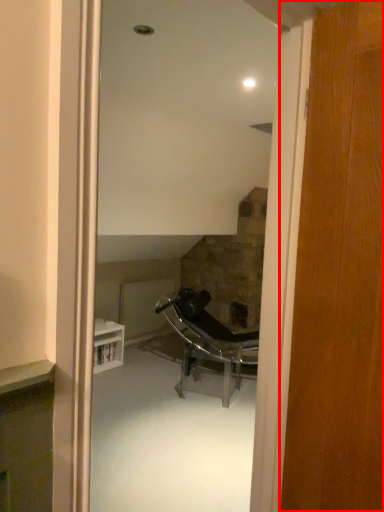
Question: From the image, what is the correct spatial relationship of door (annotated by the red box) in relation to chair?

Choices:
 (A) right
 (B) left

Answer: (A)